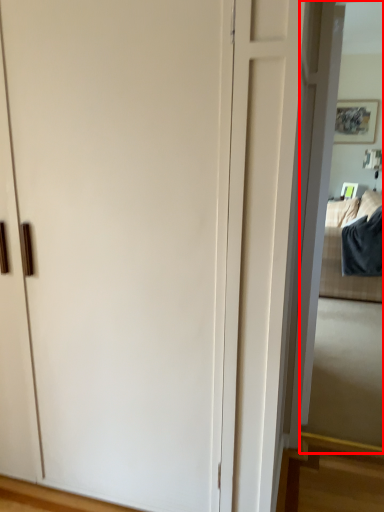
Question: Where is mirror (annotated by the red box) located in relation to bedding in the image?

Choices:
 (A) right
 (B) left

Answer: (B)